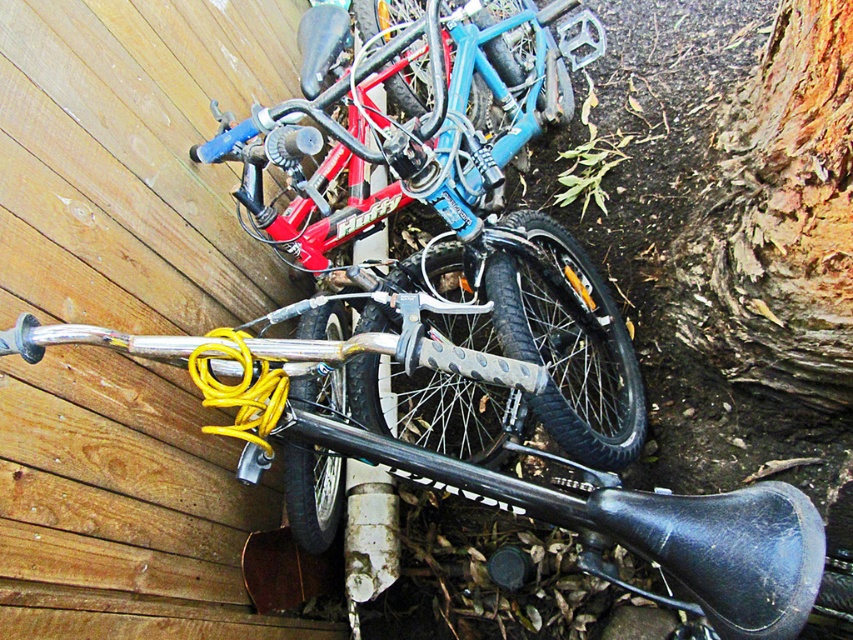
Question: Which point is farther to the camera?

Choices:
 (A) brown rough bark at lower right
 (B) matte blue bicycle at center

Answer: (A)

Question: Which point is farther to the camera?

Choices:
 (A) brown rough bark at lower right
 (B) matte blue bicycle at center

Answer: (A)

Question: Is matte blue bicycle at center to the left of brown rough bark at lower right from the viewer's perspective?

Choices:
 (A) no
 (B) yes

Answer: (B)

Question: Which of the following is the closest to the observer?

Choices:
 (A) brown rough bark at lower right
 (B) matte blue bicycle at center

Answer: (B)

Question: Is matte blue bicycle at center to the left of brown rough bark at lower right from the viewer's perspective?

Choices:
 (A) yes
 (B) no

Answer: (A)

Question: Does matte blue bicycle at center have a lesser width compared to brown rough bark at lower right?

Choices:
 (A) no
 (B) yes

Answer: (A)